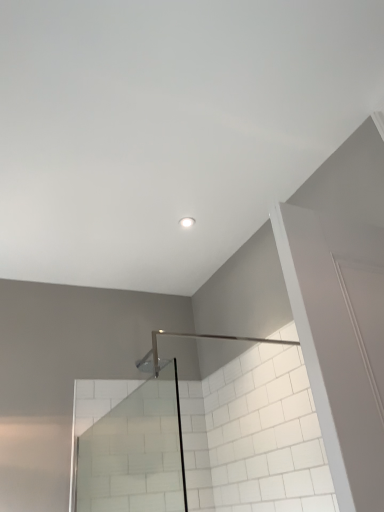
What do you see at coordinates (187, 222) in the screenshot? This screenshot has width=384, height=512. I see `white glossy light fixture at center` at bounding box center [187, 222].

You are a GUI agent. You are given a task and a screenshot of the screen. Output one action in this format:
    pyautogui.click(x=<x>, y=<y>)
    Task: Click on the white glossy light fixture at center
    Image resolution: width=384 pixels, height=512 pixels.
    Given the screenshot: What is the action you would take?
    pyautogui.click(x=187, y=222)

You are a GUI agent. You are given a task and a screenshot of the screen. Output one action in this format:
    pyautogui.click(x=<x>, y=<y>)
    Task: Click on the transparent glass shower door at center
    The width and height of the screenshot is (384, 512).
    Given the screenshot: What is the action you would take?
    click(128, 446)

What is the approximate width of transparent glass shower door at center?

transparent glass shower door at center is 4.77 feet wide.

Image resolution: width=384 pixels, height=512 pixels. What do you see at coordinates (128, 446) in the screenshot? I see `transparent glass shower door at center` at bounding box center [128, 446].

Identify the location of white glossy light fixture at center. This screenshot has height=512, width=384. (187, 222).

Considering the positions of objects transparent glass shower door at center and white glossy light fixture at center in the image provided, who is more to the right, transparent glass shower door at center or white glossy light fixture at center?

Positioned to the right is white glossy light fixture at center.

Considering their positions, is transparent glass shower door at center located in front of or behind white glossy light fixture at center?

Visually, transparent glass shower door at center is located in front of white glossy light fixture at center.

Which is nearer, [80,462] or [186,219]?

Point [80,462] appears to be closer to the viewer than point [186,219].

From the image's perspective, who appears lower, transparent glass shower door at center or white glossy light fixture at center?

transparent glass shower door at center, from the image's perspective.

Based on the photo, from a real-world perspective, between transparent glass shower door at center and white glossy light fixture at center, who is vertically higher?

white glossy light fixture at center is physically above.

Does transparent glass shower door at center have a lesser width compared to white glossy light fixture at center?

No.

Considering the sizes of transparent glass shower door at center and white glossy light fixture at center in the image, is transparent glass shower door at center taller or shorter than white glossy light fixture at center?

In the image, transparent glass shower door at center appears to be taller than white glossy light fixture at center.

Considering the relative sizes of transparent glass shower door at center and white glossy light fixture at center in the image provided, is transparent glass shower door at center smaller than white glossy light fixture at center?

Actually, transparent glass shower door at center might be larger than white glossy light fixture at center.

Is transparent glass shower door at center situated inside white glossy light fixture at center or outside?

transparent glass shower door at center exists outside the volume of white glossy light fixture at center.

Looking at this image, is transparent glass shower door at center directly adjacent to white glossy light fixture at center?

No.

Looking at this image, is transparent glass shower door at center turned away from white glossy light fixture at center?

No, transparent glass shower door at center is not facing away from white glossy light fixture at center.

How different are the orientations of transparent glass shower door at center and white glossy light fixture at center in degrees?

The angle between the facing direction of transparent glass shower door at center and the facing direction of white glossy light fixture at center is 2.71 degrees.

At what (x,y) coordinates should I click in order to perform the action: click on glass door below the white glossy light fixture at center (from the image's perspective). Please return your answer as a coordinate pair (x, y). This screenshot has width=384, height=512. Looking at the image, I should click on (128, 446).

Is white glossy light fixture at center to the left or to the right of transparent glass shower door at center in the image?

white glossy light fixture at center is to the right of transparent glass shower door at center.

Which object is closer to the camera taking this photo, white glossy light fixture at center or transparent glass shower door at center?

transparent glass shower door at center is closer to the camera.

Is point (193, 221) farther from camera compared to point (125, 511)?

Yes, point (193, 221) is behind point (125, 511).

From the image's perspective, is white glossy light fixture at center positioned above or below transparent glass shower door at center?

Clearly, from the image's perspective, white glossy light fixture at center is above transparent glass shower door at center.

From a real-world perspective, is white glossy light fixture at center on transparent glass shower door at center?

Yes.

Does white glossy light fixture at center have a lesser width compared to transparent glass shower door at center?

Yes, white glossy light fixture at center is thinner than transparent glass shower door at center.

Is white glossy light fixture at center taller than transparent glass shower door at center?

Incorrect, the height of white glossy light fixture at center is not larger of that of transparent glass shower door at center.

Is white glossy light fixture at center smaller than transparent glass shower door at center?

Indeed, white glossy light fixture at center has a smaller size compared to transparent glass shower door at center.

Is transparent glass shower door at center a part of white glossy light fixture at center?

No.

Is white glossy light fixture at center next to transparent glass shower door at center and touching it?

No, white glossy light fixture at center is not touching transparent glass shower door at center.

Is white glossy light fixture at center facing towards transparent glass shower door at center?

No, white glossy light fixture at center is not oriented towards transparent glass shower door at center.

How different are the orientations of white glossy light fixture at center and transparent glass shower door at center in degrees?

2.71 degrees separate the facing orientations of white glossy light fixture at center and transparent glass shower door at center.

Measure the distance from white glossy light fixture at center to transparent glass shower door at center.

white glossy light fixture at center is 4.20 feet away from transparent glass shower door at center.

Locate an element on the screen. This screenshot has height=512, width=384. light fixture above the transparent glass shower door at center (from the image's perspective) is located at coordinates (187, 222).

At what (x,y) coordinates should I click in order to perform the action: click on glass door below the white glossy light fixture at center (from a real-world perspective). Please return your answer as a coordinate pair (x, y). This screenshot has width=384, height=512. Looking at the image, I should click on pyautogui.click(x=128, y=446).

Image resolution: width=384 pixels, height=512 pixels. In order to click on light fixture behind the transparent glass shower door at center in this screenshot , I will do [x=187, y=222].